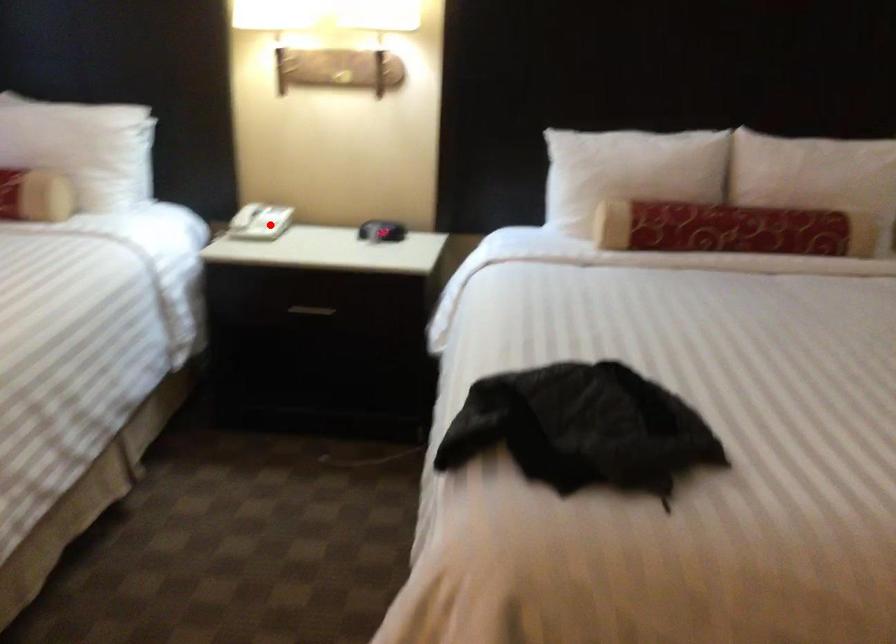
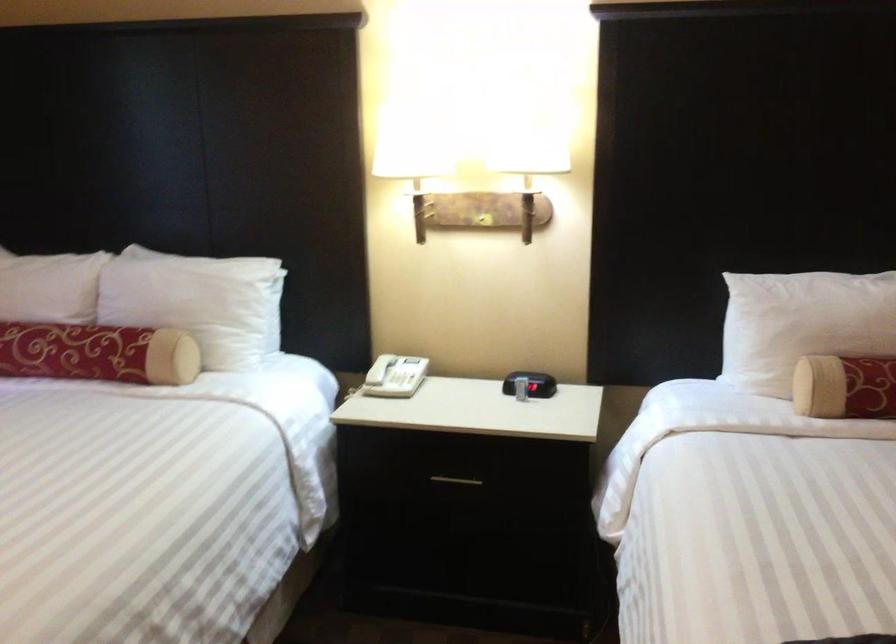
Question: I am providing you with two images of the same scene from different viewpoints. A red point is marked on the first image. Is the red point's position out of view in image 2?

Choices:
 (A) Yes
 (B) No

Answer: (B)